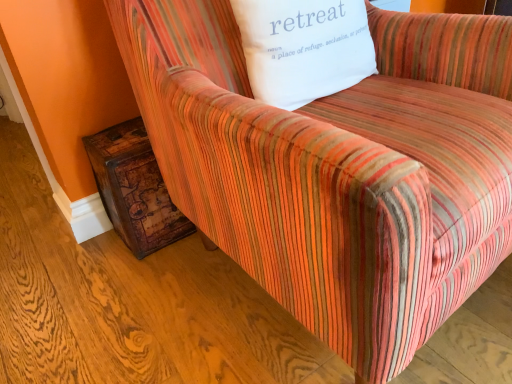
Question: From the image's perspective, is white cotton pillow at upper center above rustic wood side table at lower left?

Choices:
 (A) no
 (B) yes

Answer: (B)

Question: Are white cotton pillow at upper center and rustic wood side table at lower left making contact?

Choices:
 (A) no
 (B) yes

Answer: (A)

Question: Is white cotton pillow at upper center looking in the opposite direction of rustic wood side table at lower left?

Choices:
 (A) yes
 (B) no

Answer: (B)

Question: Does white cotton pillow at upper center have a lesser height compared to rustic wood side table at lower left?

Choices:
 (A) no
 (B) yes

Answer: (B)

Question: Does white cotton pillow at upper center lie behind rustic wood side table at lower left?

Choices:
 (A) yes
 (B) no

Answer: (B)

Question: Considering the relative sizes of white cotton pillow at upper center and rustic wood side table at lower left in the image provided, is white cotton pillow at upper center smaller than rustic wood side table at lower left?

Choices:
 (A) yes
 (B) no

Answer: (B)

Question: Does rustic wood side table at lower left appear on the right side of white cotton pillow at upper center?

Choices:
 (A) no
 (B) yes

Answer: (A)

Question: Can we say rustic wood side table at lower left lies outside white cotton pillow at upper center?

Choices:
 (A) no
 (B) yes

Answer: (B)

Question: Can you confirm if rustic wood side table at lower left is positioned to the left of white cotton pillow at upper center?

Choices:
 (A) no
 (B) yes

Answer: (B)

Question: Is rustic wood side table at lower left wider than white cotton pillow at upper center?

Choices:
 (A) yes
 (B) no

Answer: (A)

Question: Is rustic wood side table at lower left positioned before white cotton pillow at upper center?

Choices:
 (A) no
 (B) yes

Answer: (A)

Question: Is there a large distance between rustic wood side table at lower left and white cotton pillow at upper center?

Choices:
 (A) yes
 (B) no

Answer: (B)

Question: Is white cotton pillow at upper center in front of or behind rustic wood side table at lower left in the image?

Choices:
 (A) front
 (B) behind

Answer: (A)